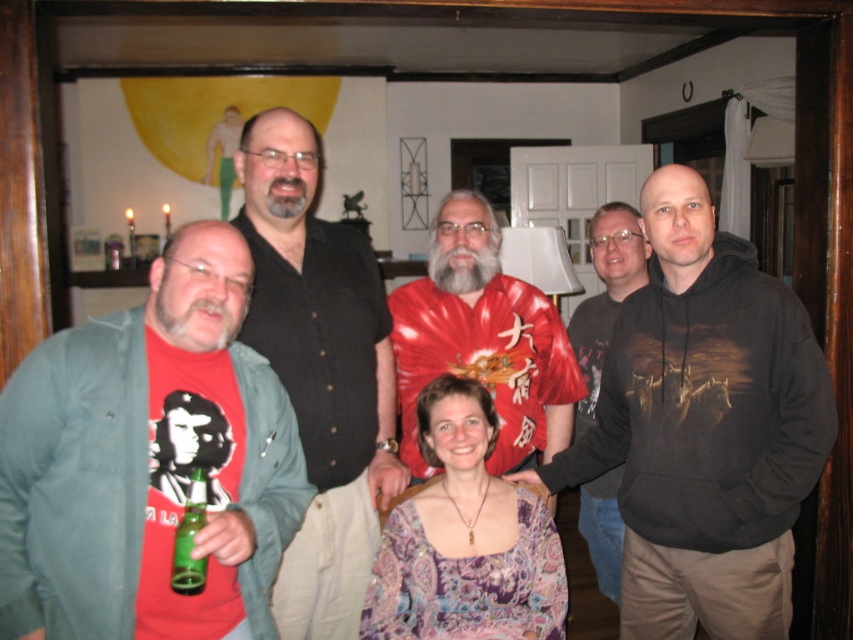
Is dark gray hoodie at right thinner than green glass bottle at lower left?

No.

Does dark gray hoodie at right appear on the right side of green glass bottle at lower left?

Correct, you'll find dark gray hoodie at right to the right of green glass bottle at lower left.

The height and width of the screenshot is (640, 853). I want to click on dark gray hoodie at right, so click(705, 428).

Does dark gray hoodie at right appear on the right side of dark brown hoodie at right?

Incorrect, dark gray hoodie at right is not on the right side of dark brown hoodie at right.

Is dark gray hoodie at right positioned at the back of dark brown hoodie at right?

No, it is in front of dark brown hoodie at right.

Who is more forward, (x=758, y=529) or (x=613, y=305)?

Point (x=758, y=529)

You are a GUI agent. You are given a task and a screenshot of the screen. Output one action in this format:
    pyautogui.click(x=<x>, y=<y>)
    Task: Click on the dark gray hoodie at right
    The width and height of the screenshot is (853, 640).
    Given the screenshot: What is the action you would take?
    pyautogui.click(x=705, y=428)

Is paisley fabric blouse at center bigger than green glass bottle at lower left?

Yes.

In the scene shown: Is paisley fabric blouse at center smaller than green glass bottle at lower left?

No, paisley fabric blouse at center is not smaller than green glass bottle at lower left.

Locate an element on the screen. This screenshot has width=853, height=640. paisley fabric blouse at center is located at coordinates (465, 540).

At what (x,y) coordinates should I click in order to perform the action: click on paisley fabric blouse at center. Please return your answer as a coordinate pair (x, y). Looking at the image, I should click on (465, 540).